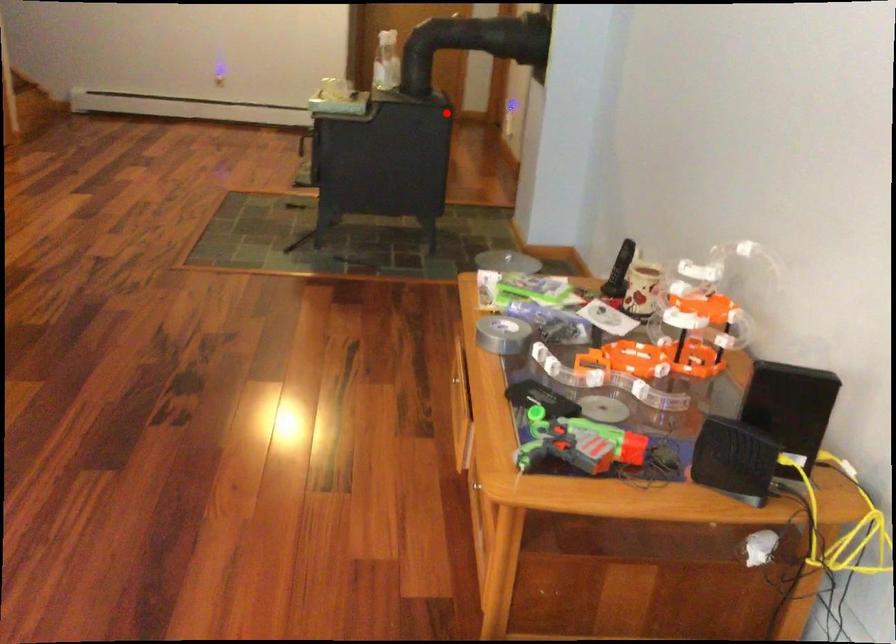
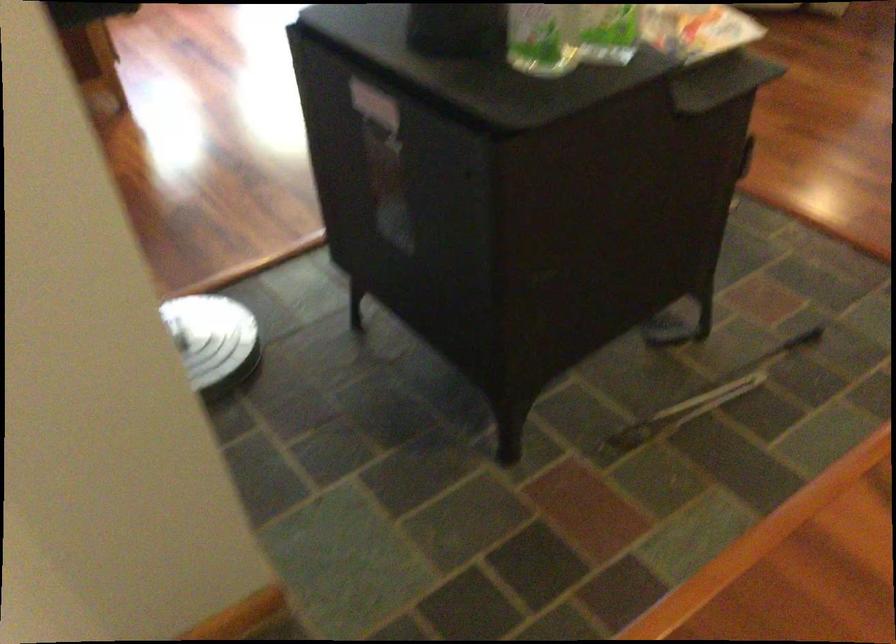
Question: I am providing you with two images of the same scene from different viewpoints. In image1, a red point is highlighted. Considering the same 3D point in image2, which of the following is correct?

Choices:
 (A) It is closer
 (B) It is farther

Answer: (A)